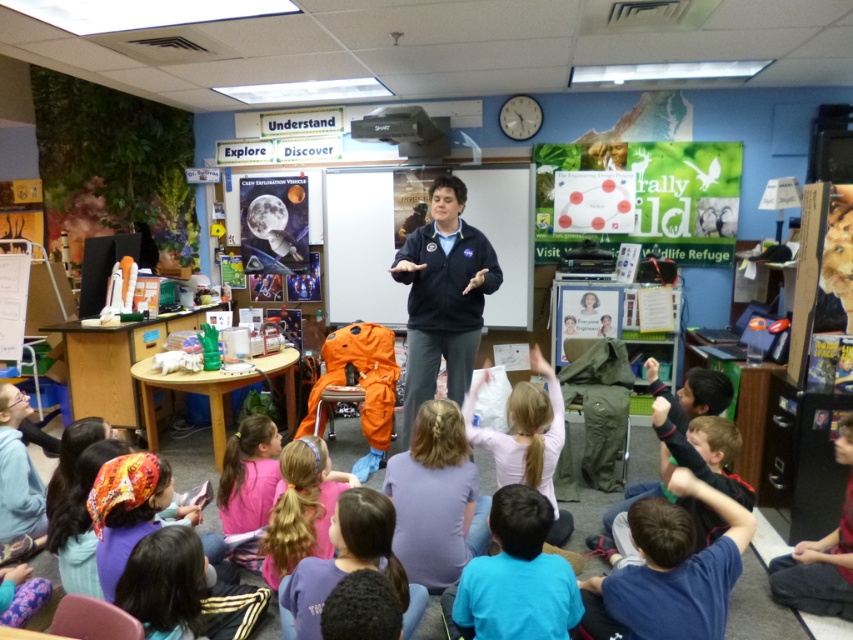
Does dark blue jacket at center come in front of purple cotton shirt at lower center?

No, dark blue jacket at center is behind purple cotton shirt at lower center.

Does dark blue jacket at center come behind purple cotton shirt at lower center?

That is True.

Which is in front, point (479, 275) or point (387, 541)?

Positioned in front is point (387, 541).

Locate an element on the screen. The width and height of the screenshot is (853, 640). dark blue jacket at center is located at coordinates (444, 296).

Is point (392, 220) behind point (796, 547)?

That is True.

What do you see at coordinates (360, 248) in the screenshot?
I see `whiteboard at center` at bounding box center [360, 248].

Is point (339, 172) positioned behind point (846, 518)?

That is True.

Where is `whiteboard at center`? Image resolution: width=853 pixels, height=640 pixels. whiteboard at center is located at coordinates (360, 248).

Is whiteboard at center smaller than purple cotton shirt at lower center?

No, whiteboard at center is not smaller than purple cotton shirt at lower center.

In the scene shown: Which is more to the left, whiteboard at center or purple cotton shirt at lower center?

whiteboard at center

Which is in front, point (483, 205) or point (407, 609)?

Positioned in front is point (407, 609).

You are a GUI agent. You are given a task and a screenshot of the screen. Output one action in this format:
    pyautogui.click(x=<x>, y=<y>)
    Task: Click on the whiteboard at center
    The image size is (853, 640).
    Given the screenshot: What is the action you would take?
    pyautogui.click(x=360, y=248)